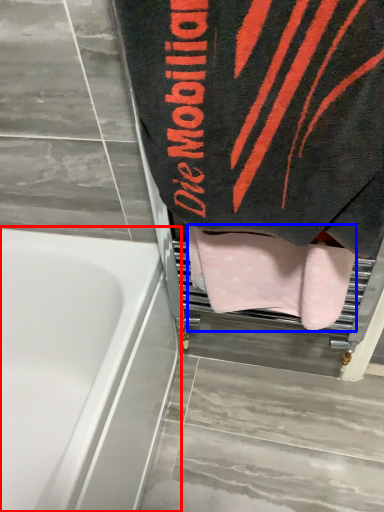
Question: Among these objects, which one is nearest to the camera, bathtub (highlighted by a red box) or towel (highlighted by a blue box)?

Choices:
 (A) bathtub
 (B) towel

Answer: (A)